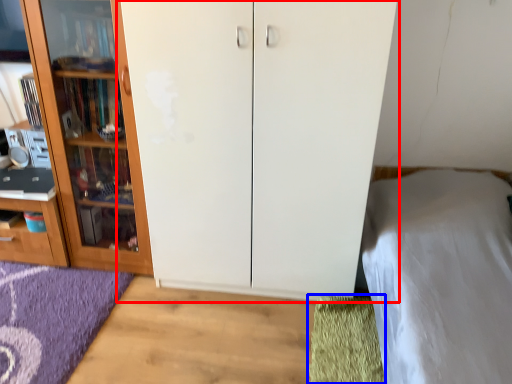
Question: Which object appears closest to the camera in this image, cupboard (highlighted by a red box) or doormat (highlighted by a blue box)?

Choices:
 (A) cupboard
 (B) doormat

Answer: (A)